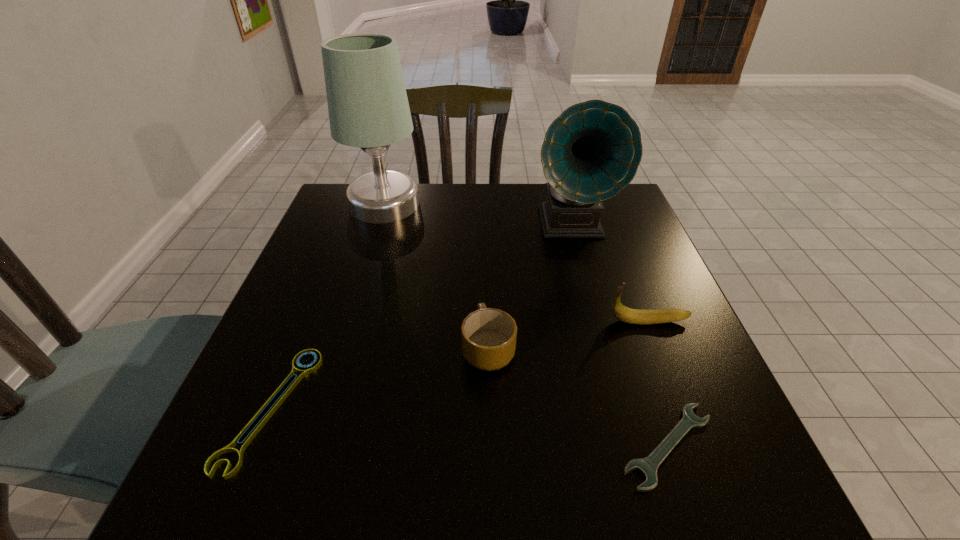
At what (x,y) coordinates should I click in order to perform the action: click on the tallest object. Please return your answer as a coordinate pair (x, y). The height and width of the screenshot is (540, 960). Looking at the image, I should click on (368, 107).

In order to click on the second tallest object in this screenshot , I will do `click(591, 151)`.

Where is `banana`? banana is located at coordinates (633, 316).

The width and height of the screenshot is (960, 540). In order to click on the third object from left to right in this screenshot , I will do `click(488, 335)`.

Locate an element on the screen. mug is located at coordinates (488, 335).

Where is `the left wrench`? The image size is (960, 540). the left wrench is located at coordinates (292, 379).

Where is `the right wrench`? Image resolution: width=960 pixels, height=540 pixels. the right wrench is located at coordinates (648, 466).

Identify the location of free space located 0.370m on the base of the tallest object. (550, 204).

Locate an element on the screen. Image resolution: width=960 pixels, height=540 pixels. blank area located from the horn of the phonograph_record is located at coordinates coord(585,275).

What are the coordinates of `vacant position located at the stem of the fourth shortest object` in the screenshot? It's located at (415, 321).